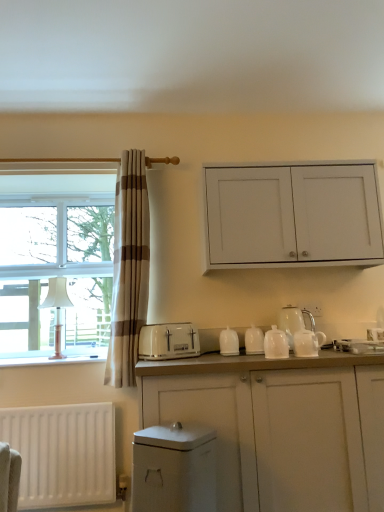
Question: Would you say white glossy teapot at right, the 2th tea pot when ordered from back to front, is inside or outside white glossy tea pot at right, which ranks as the first tea pot in back-to-front order?

Choices:
 (A) inside
 (B) outside

Answer: (B)

Question: Considering the positions of white glossy teapot at right, placed as the first tea pot when sorted from front to back, and white glossy tea pot at right, which ranks as the first tea pot in back-to-front order, in the image, is white glossy teapot at right, placed as the first tea pot when sorted from front to back, taller or shorter than white glossy tea pot at right, which ranks as the first tea pot in back-to-front order,?

Choices:
 (A) tall
 (B) short

Answer: (B)

Question: Which object is positioned farthest from the white matte radiator at lower left?

Choices:
 (A) white glossy teapot at center, the 3th tableware from the back
 (B) white plastic toaster at center
 (C) white glossy teapot at center, the second tableware when ordered from front to back
 (D) white glossy dishwasher at lower center
 (E) white glossy teapot at right, the 2th tea pot when ordered from back to front

Answer: (E)

Question: Which object is the closest to the white glossy tea pot at right, the second tea pot when ordered from front to back?

Choices:
 (A) white matte cabinet at center, positioned as the first cabinetry in bottom-to-top order
 (B) white glossy teapot at center, the second tableware when ordered from front to back
 (C) white matte cabinet at upper right, the first cabinetry when ordered from top to bottom
 (D) white glossy teapot at center, the 3th tableware from the front
 (E) beige striped curtain at left

Answer: (D)